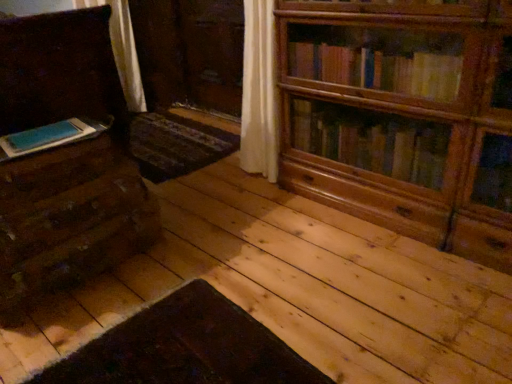
Question: Is matte brown chest of drawers at left closer to camera compared to wooden bookcase at upper right?

Choices:
 (A) no
 (B) yes

Answer: (A)

Question: Considering the relative sizes of matte brown chest of drawers at left and wooden bookcase at upper right in the image provided, is matte brown chest of drawers at left wider than wooden bookcase at upper right?

Choices:
 (A) yes
 (B) no

Answer: (A)

Question: Is matte brown chest of drawers at left next to wooden bookcase at upper right and touching it?

Choices:
 (A) no
 (B) yes

Answer: (A)

Question: From the image's perspective, would you say matte brown chest of drawers at left is positioned over wooden bookcase at upper right?

Choices:
 (A) yes
 (B) no

Answer: (A)

Question: Does matte brown chest of drawers at left lie behind wooden bookcase at upper right?

Choices:
 (A) yes
 (B) no

Answer: (A)

Question: From a real-world perspective, is wooden bookcase at upper right physically located above or below matte wood drawer at left?

Choices:
 (A) below
 (B) above

Answer: (A)

Question: Considering the positions of wooden bookcase at upper right and matte wood drawer at left in the image, is wooden bookcase at upper right bigger or smaller than matte wood drawer at left?

Choices:
 (A) small
 (B) big

Answer: (B)

Question: From the image's perspective, is wooden bookcase at upper right located above or below matte wood drawer at left?

Choices:
 (A) above
 (B) below

Answer: (A)

Question: Would you say wooden bookcase at upper right is inside or outside matte wood drawer at left?

Choices:
 (A) inside
 (B) outside

Answer: (B)

Question: From a real-world perspective, is matte brown chest of drawers at left above or below wooden bookcase at upper right?

Choices:
 (A) below
 (B) above

Answer: (B)

Question: Considering the positions of matte brown chest of drawers at left and wooden bookcase at upper right in the image, is matte brown chest of drawers at left taller or shorter than wooden bookcase at upper right?

Choices:
 (A) tall
 (B) short

Answer: (A)

Question: Does point (77, 249) appear closer or farther from the camera than point (384, 79)?

Choices:
 (A) farther
 (B) closer

Answer: (B)

Question: Visually, is matte brown chest of drawers at left positioned to the left or to the right of wooden bookcase at upper right?

Choices:
 (A) right
 (B) left

Answer: (B)

Question: In terms of height, does blue matte book at left look taller or shorter compared to matte wood drawer at left?

Choices:
 (A) short
 (B) tall

Answer: (A)

Question: Is blue matte book at left bigger or smaller than matte wood drawer at left?

Choices:
 (A) small
 (B) big

Answer: (A)